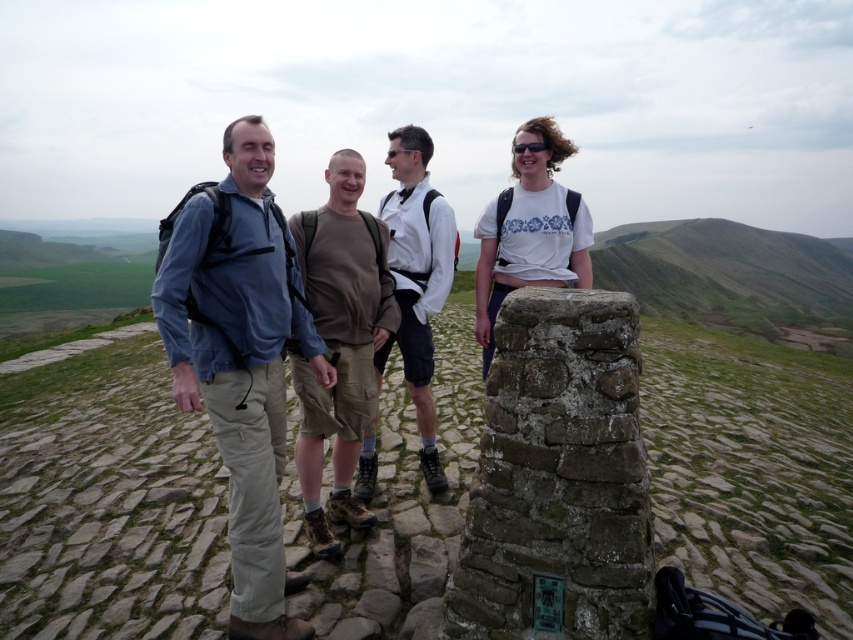
Question: From the image, what is the correct spatial relationship of white cotton t-shirt at center in relation to black plastic goggles at upper center?

Choices:
 (A) above
 (B) below

Answer: (B)

Question: Among these points, which one is nearest to the camera?

Choices:
 (A) (241, 604)
 (B) (531, 148)

Answer: (A)

Question: Which of the following is the farthest from the observer?

Choices:
 (A) (228, 538)
 (B) (437, 460)
 (C) (532, 150)

Answer: (B)

Question: Among these objects, which one is nearest to the camera?

Choices:
 (A) black plastic goggles at upper center
 (B) white cotton t-shirt at center
 (C) matte blue shirt at center
 (D) brown cotton shorts at center

Answer: (C)

Question: Does matte blue shirt at center have a lesser width compared to brown cotton shirt at center?

Choices:
 (A) no
 (B) yes

Answer: (A)

Question: Can you confirm if matte blue shirt at center is smaller than black plastic goggles at upper center?

Choices:
 (A) no
 (B) yes

Answer: (A)